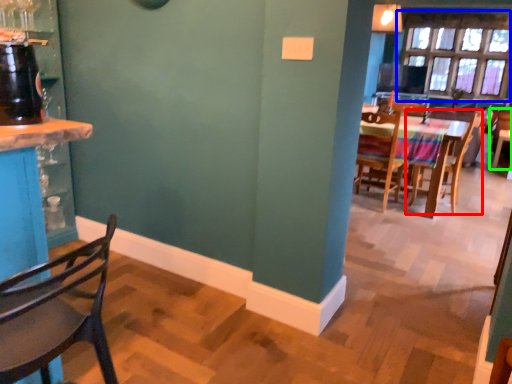
Question: Which is farther away from chair (highlighted by a red box)? window (highlighted by a blue box) or chair (highlighted by a green box)?

Choices:
 (A) window
 (B) chair

Answer: (A)